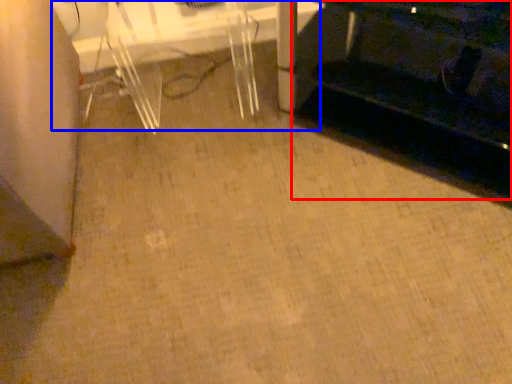
Question: Which object is closer to the camera taking this photo, furniture (highlighted by a red box) or table (highlighted by a blue box)?

Choices:
 (A) furniture
 (B) table

Answer: (A)